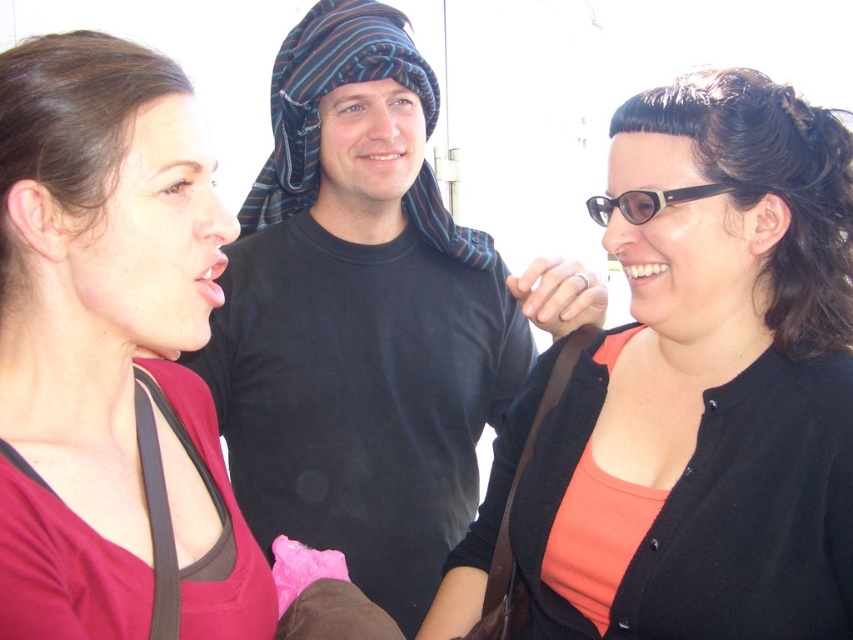
Question: Does black cotton shirt at center lie in front of black plastic glasses at upper right?

Choices:
 (A) no
 (B) yes

Answer: (A)

Question: In this image, where is matte black cardigan at center located relative to black cotton shirt at center?

Choices:
 (A) below
 (B) above

Answer: (A)

Question: Which object appears farthest from the camera in this image?

Choices:
 (A) black cotton shirt at center
 (B) matte black cardigan at center
 (C) matte red shirt at left
 (D) black plastic glasses at upper right

Answer: (A)

Question: Which of the following is the closest to the observer?

Choices:
 (A) matte red shirt at left
 (B) black plastic glasses at upper right
 (C) black cotton shirt at center
 (D) matte black cardigan at center

Answer: (A)

Question: Estimate the real-world distances between objects in this image. Which object is farther from the black cotton shirt at center?

Choices:
 (A) matte red shirt at left
 (B) black plastic glasses at upper right

Answer: (B)

Question: From the image, what is the correct spatial relationship of matte red shirt at left in relation to black plastic glasses at upper right?

Choices:
 (A) right
 (B) left

Answer: (B)